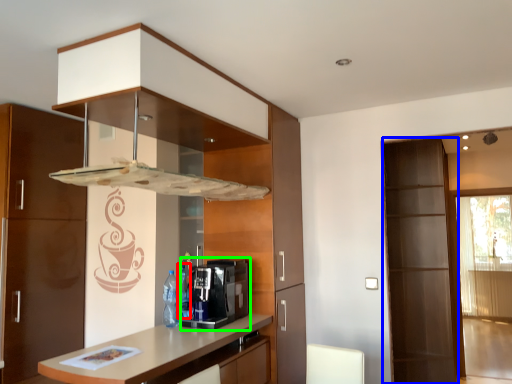
Question: Based on their relative distances, which object is nearer to bottle (highlighted by a red box)? Choose from screen door (highlighted by a blue box) and coffee machine (highlighted by a green box).

Choices:
 (A) screen door
 (B) coffee machine

Answer: (B)